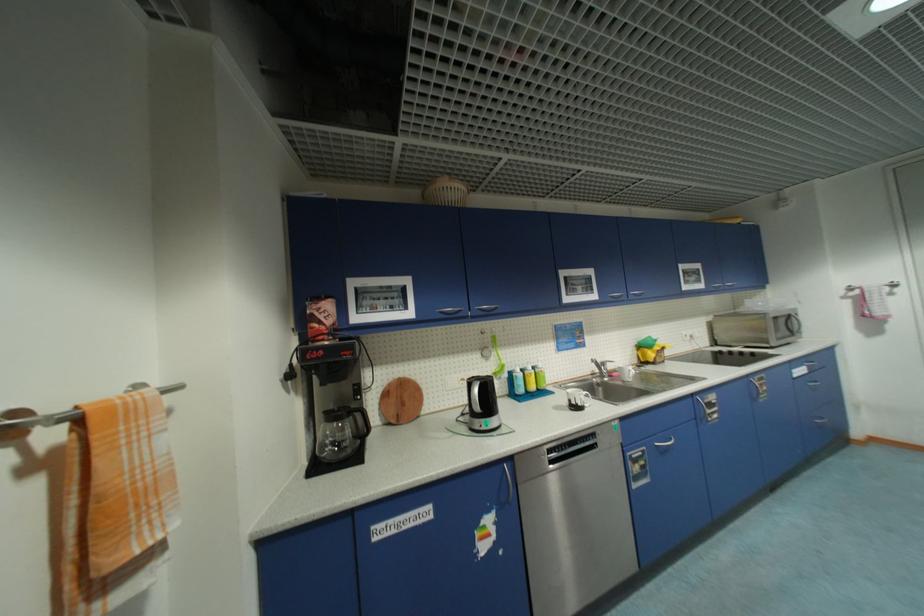
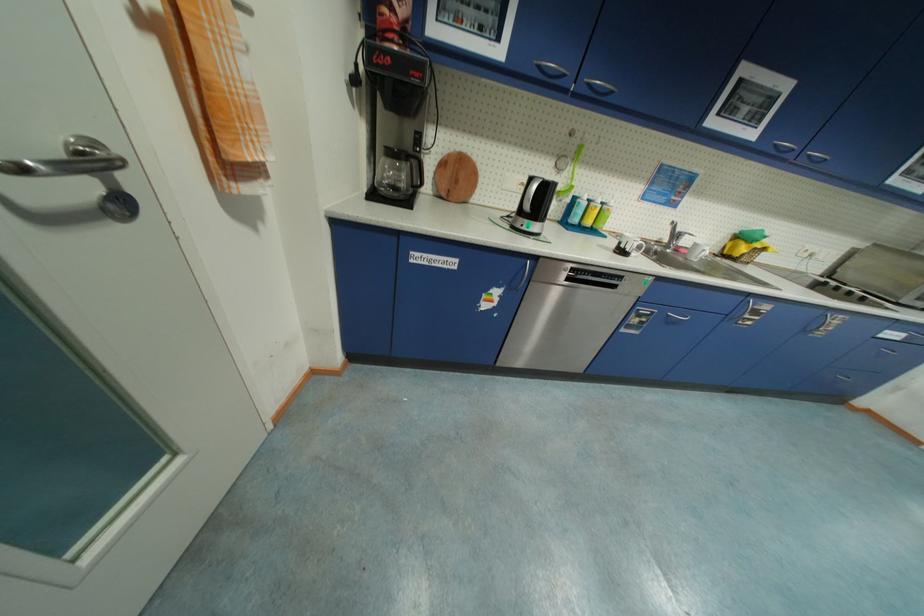
The point at (468, 381) is marked in the first image. Where is the corresponding point in the second image?

(529, 185)